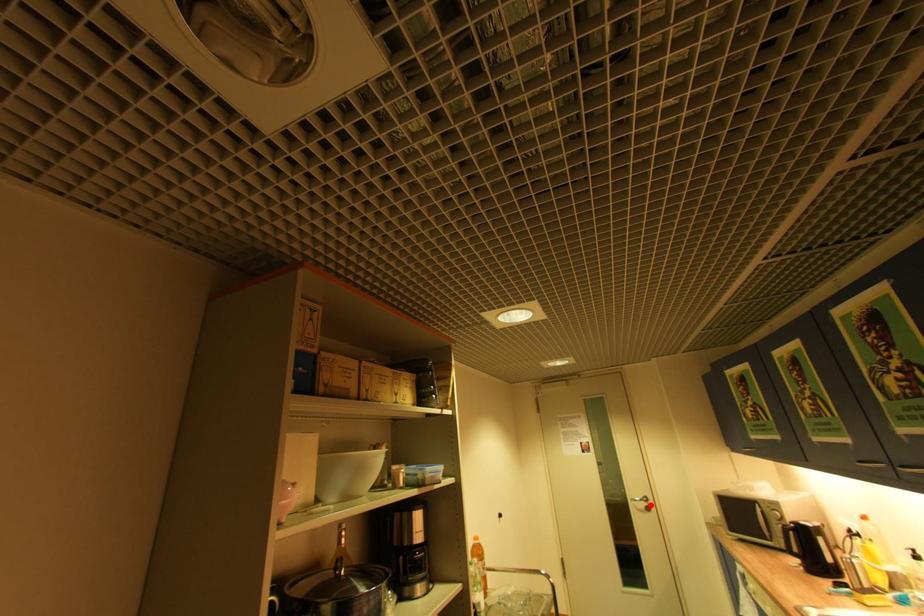
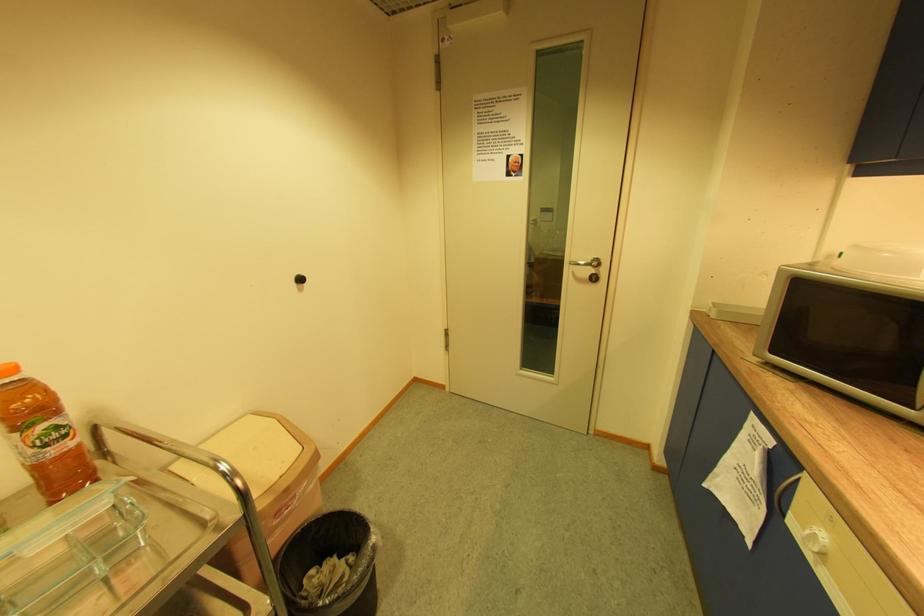
Find the pixel in the second image that matches the highlighted location in the first image.

(598, 272)